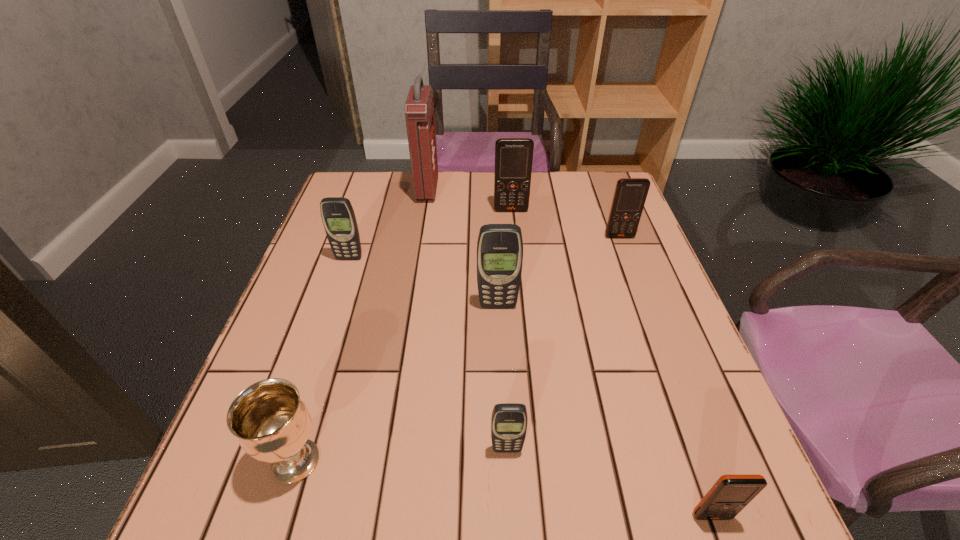
I want to click on gray cellular telephone that is the second closest to the farthest cellular telephone, so click(338, 217).

This screenshot has width=960, height=540. What are the coordinates of `gray cellular telephone that can be found as the second closest to the seventh nearest object` in the screenshot? It's located at (338, 217).